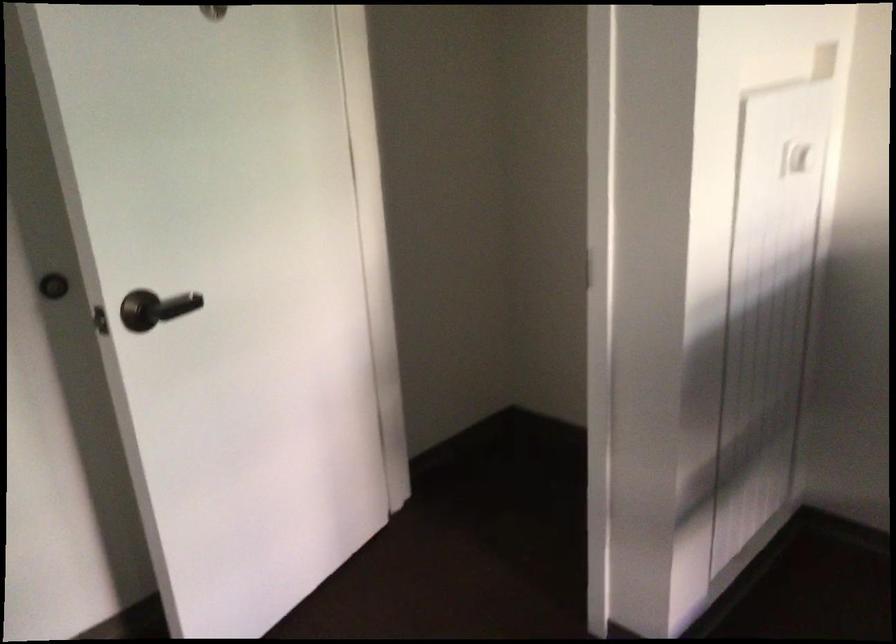
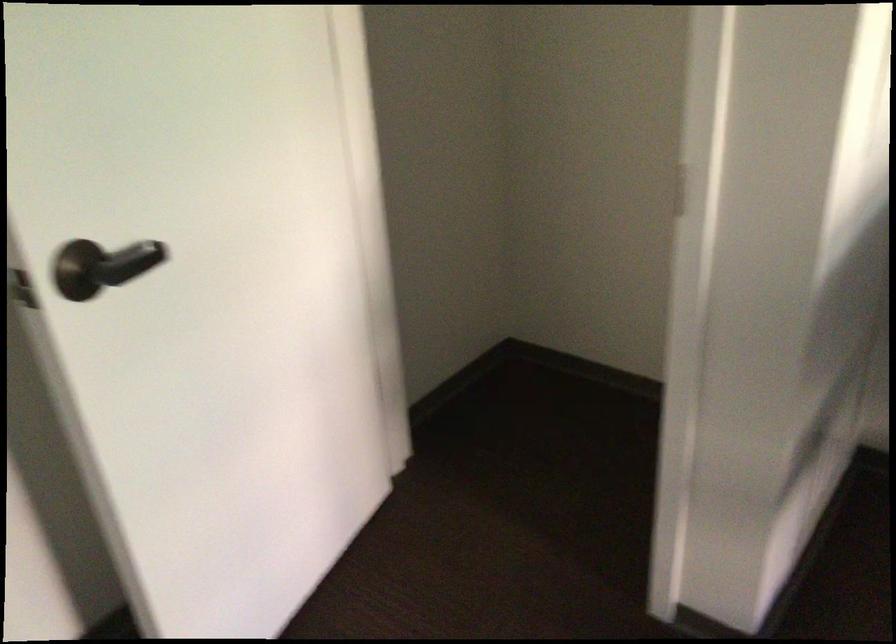
In a continuous first-person perspective shot, in which direction is the camera moving?

The movement direction of the cameraman is left, forward.